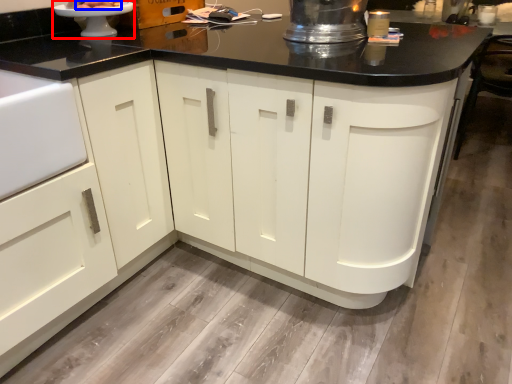
Question: Which object appears closest to the camera in this image, appliance (highlighted by a red box) or food (highlighted by a blue box)?

Choices:
 (A) appliance
 (B) food

Answer: (A)